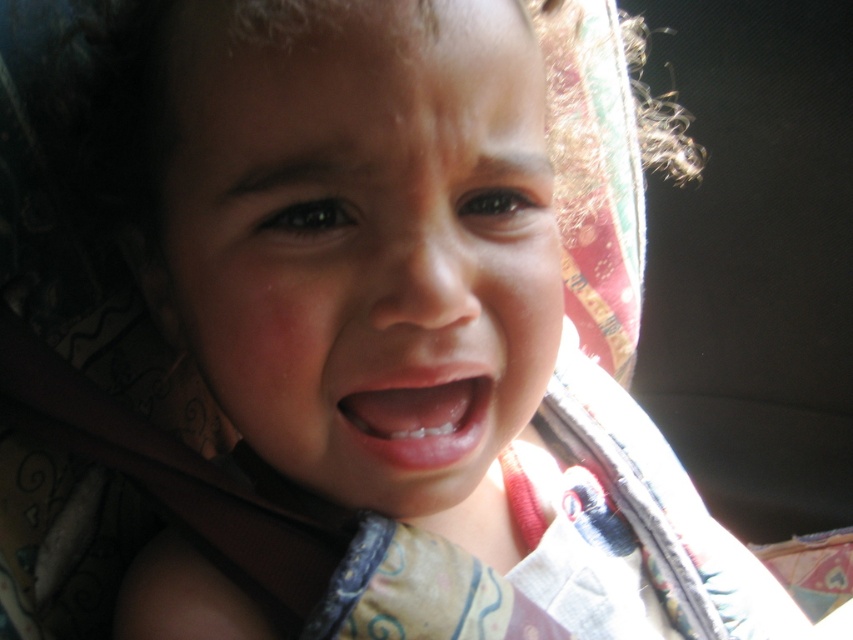
Question: Is smooth skin face at center above pink glossy lips at center?

Choices:
 (A) yes
 (B) no

Answer: (A)

Question: Is smooth skin face at center below pink glossy lips at center?

Choices:
 (A) yes
 (B) no

Answer: (B)

Question: Among these points, which one is nearest to the camera?

Choices:
 (A) coord(418,460)
 (B) coord(497,323)

Answer: (A)

Question: Is smooth skin face at center positioned before pink glossy lips at center?

Choices:
 (A) yes
 (B) no

Answer: (A)